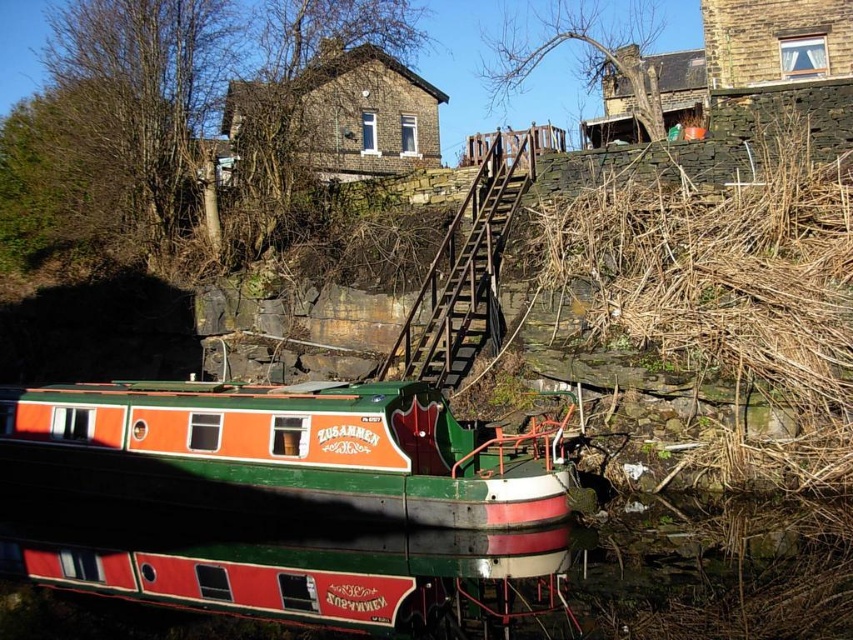
Can you confirm if green painted wood boat at center is positioned to the left of wooden stairs at upper center?

Yes, green painted wood boat at center is to the left of wooden stairs at upper center.

Find the location of a particular element. Image resolution: width=853 pixels, height=640 pixels. green painted wood boat at center is located at coordinates pos(285,451).